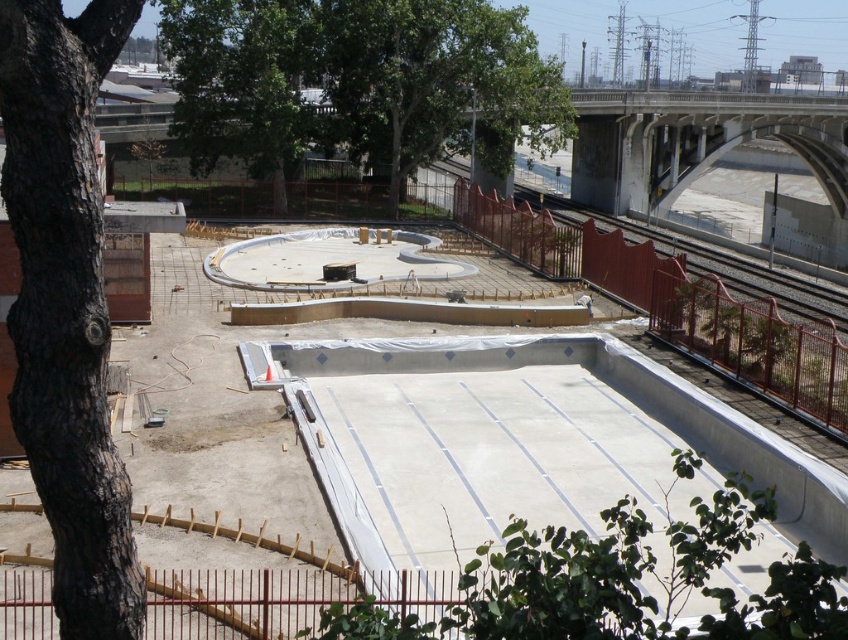
Based on the photo, what is the 2D coordinate of the black rough bark tree at left in the image?

The 2D coordinate of the black rough bark tree at left is at point (x=65, y=305).

You are a construction worker looking at the construction site. You need to determine which tree is shorter between the black rough bark tree at left and the green leafy tree at upper center. Which one is it?

The black rough bark tree at left is shorter than the green leafy tree at upper center.